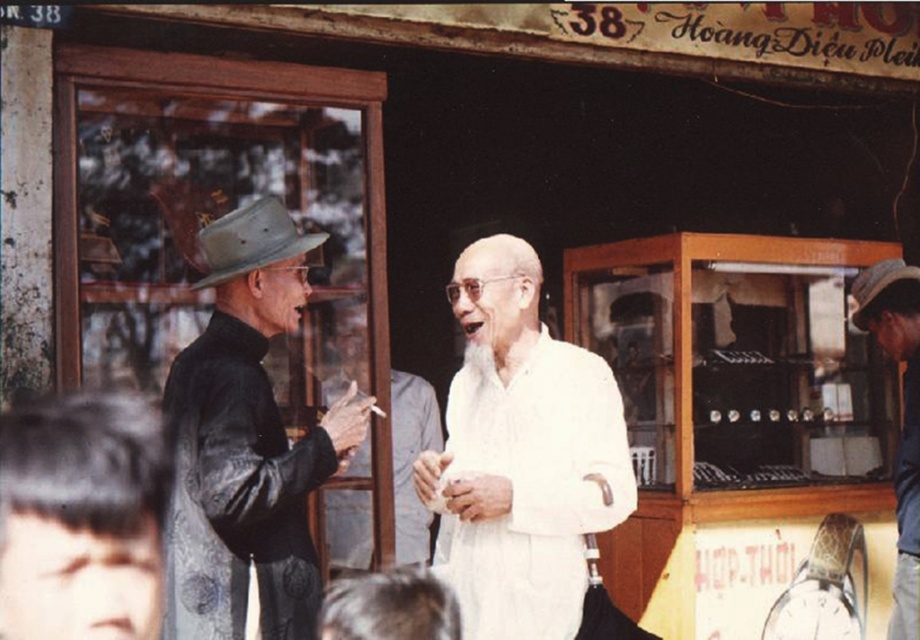
Can you confirm if white matte/soft fabric at center is positioned to the right of dark gray felt hat at left?

Correct, you'll find white matte/soft fabric at center to the right of dark gray felt hat at left.

Which is more to the left, white matte/soft fabric at center or dark gray felt hat at left?

dark gray felt hat at left

Does point (461, 561) come in front of point (198, 234)?

Yes, it is.

Where is `white matte/soft fabric at center`? white matte/soft fabric at center is located at coordinates (521, 454).

From the picture: Is dark gray felt hat at left smaller than denim jacket at right?

No.

Which is more to the left, dark gray felt hat at left or denim jacket at right?

dark gray felt hat at left

The width and height of the screenshot is (920, 640). Identify the location of dark gray felt hat at left. (247, 442).

You are a GUI agent. You are given a task and a screenshot of the screen. Output one action in this format:
    pyautogui.click(x=<x>, y=<y>)
    Task: Click on the dark gray felt hat at left
    The height and width of the screenshot is (640, 920).
    Given the screenshot: What is the action you would take?
    pyautogui.click(x=247, y=442)

Between denim jacket at right and brown leather cowboy hat at left, which one appears on the right side from the viewer's perspective?

From the viewer's perspective, denim jacket at right appears more on the right side.

Between point (918, 572) and point (249, 253), which one is positioned in front?

Point (249, 253) is in front.

Locate an element on the screen. denim jacket at right is located at coordinates (903, 417).